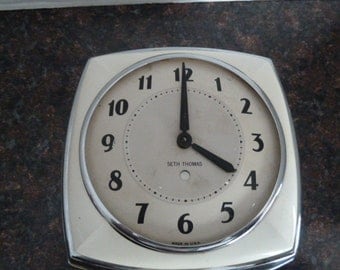
Image resolution: width=340 pixels, height=270 pixels. I want to click on dark granite surface, so click(x=320, y=161).